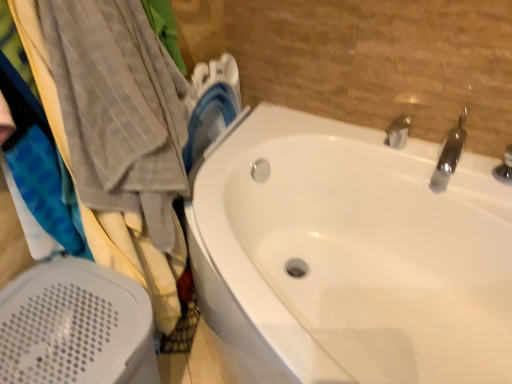
Question: Is polished chrome faucet at upper right, acting as the 2th tap starting from the left, wider than white glossy bathtub at center?

Choices:
 (A) no
 (B) yes

Answer: (A)

Question: Can you confirm if polished chrome faucet at upper right, acting as the 2th tap starting from the left, is bigger than white glossy bathtub at center?

Choices:
 (A) yes
 (B) no

Answer: (B)

Question: Is polished chrome faucet at upper right, the first tap when ordered from right to left, surrounding white glossy bathtub at center?

Choices:
 (A) no
 (B) yes

Answer: (A)

Question: From a real-world perspective, is polished chrome faucet at upper right, acting as the 2th tap starting from the left, over white glossy bathtub at center?

Choices:
 (A) no
 (B) yes

Answer: (B)

Question: Is polished chrome faucet at upper right, the first tap when ordered from right to left, to the right of white glossy bathtub at center from the viewer's perspective?

Choices:
 (A) no
 (B) yes

Answer: (B)

Question: Is polished chrome faucet at upper right, acting as the 2th tap starting from the left, closer to the viewer compared to white glossy bathtub at center?

Choices:
 (A) no
 (B) yes

Answer: (A)

Question: Is silver metallic tap at upper right, which ranks as the first tap in left-to-right order, far from white glossy bathtub at center?

Choices:
 (A) no
 (B) yes

Answer: (A)

Question: Can you confirm if silver metallic tap at upper right, which ranks as the first tap in left-to-right order, is positioned to the right of white glossy bathtub at center?

Choices:
 (A) no
 (B) yes

Answer: (B)

Question: Is silver metallic tap at upper right, the 2th tap in the right-to-left sequence, located outside white glossy bathtub at center?

Choices:
 (A) no
 (B) yes

Answer: (B)

Question: Can you confirm if silver metallic tap at upper right, the 2th tap in the right-to-left sequence, is shorter than white glossy bathtub at center?

Choices:
 (A) no
 (B) yes

Answer: (B)

Question: From a real-world perspective, is silver metallic tap at upper right, which ranks as the first tap in left-to-right order, physically below white glossy bathtub at center?

Choices:
 (A) yes
 (B) no

Answer: (B)

Question: Is white glossy bathtub at center surrounded by silver metallic tap at upper right, the 2th tap in the right-to-left sequence?

Choices:
 (A) yes
 (B) no

Answer: (B)

Question: Is polished chrome faucet at upper right, acting as the 2th tap starting from the left, far away from silver metallic tap at upper right, which ranks as the first tap in left-to-right order?

Choices:
 (A) no
 (B) yes

Answer: (A)